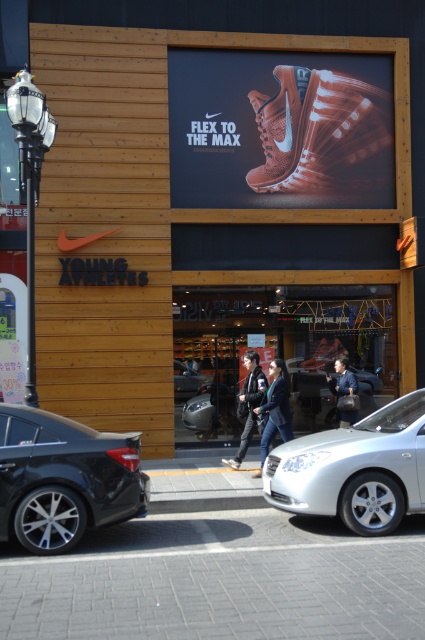
You are a delivery person trying to deliver a package to the Nike store entrance. The entrance is partially open, and you need to know if the wooden signboard at upper center is thinner than the white leather shoe at center to determine the best way to enter. Can you confirm which object is thinner?

The wooden signboard at upper center is thinner than the white leather shoe at center according to the description.

You are standing in front of the Nike store named YOUNG ATHLETES. You see a point at coordinates (356, 468). What object is located at that point?

The point at coordinates (356, 468) corresponds to the silver metallic sedan at center.